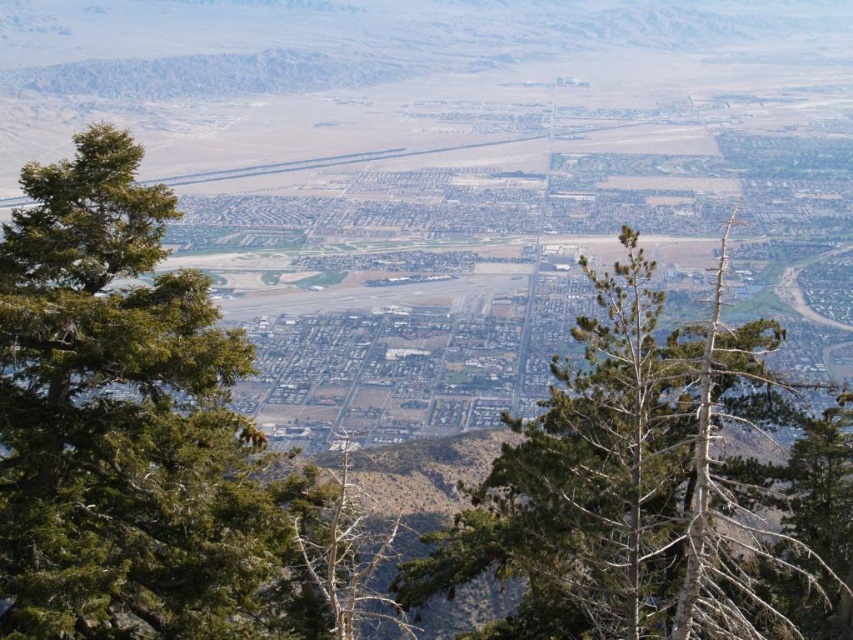
Question: Which of the following is the closest to the observer?

Choices:
 (A) (318, 593)
 (B) (109, 364)

Answer: (B)

Question: Where is green needle-like tree at center located in relation to green leafy tree at center in the image?

Choices:
 (A) left
 (B) right

Answer: (A)

Question: Is green needle-like tree at center below green leafy tree at center?

Choices:
 (A) yes
 (B) no

Answer: (A)

Question: Which point is farther to the camera?

Choices:
 (A) (134, 451)
 (B) (364, 540)
 (C) (734, 621)

Answer: (B)

Question: Can you confirm if green needle-like tree at center is bigger than bare wood tree at center?

Choices:
 (A) no
 (B) yes

Answer: (A)

Question: Which point is farther to the camera?

Choices:
 (A) (305, 520)
 (B) (747, 332)
 (C) (107, 534)

Answer: (B)